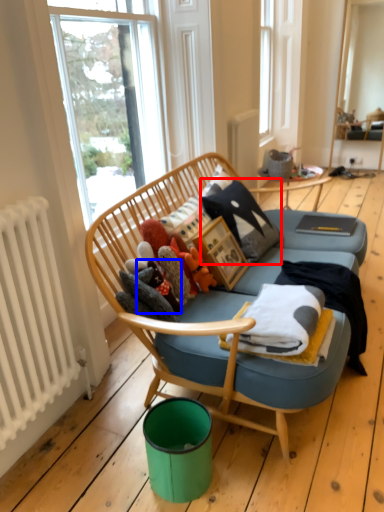
Question: Which object appears closest to the camera in this image, pillow (highlighted by a red box) or toy (highlighted by a blue box)?

Choices:
 (A) pillow
 (B) toy

Answer: (B)